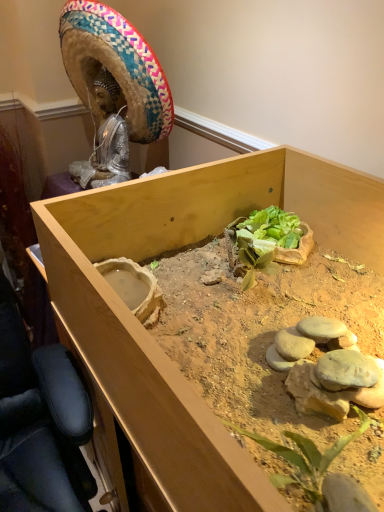
Find the location of a particular element. This screenshot has height=512, width=384. light wood/rough wooden box at center is located at coordinates click(x=146, y=331).

What do you see at coordinates (146, 331) in the screenshot?
I see `light wood/rough wooden box at center` at bounding box center [146, 331].

At what (x,y) coordinates should I click in order to perform the action: click on light wood/rough wooden box at center. Please return your answer as a coordinate pair (x, y). Looking at the image, I should click on (146, 331).